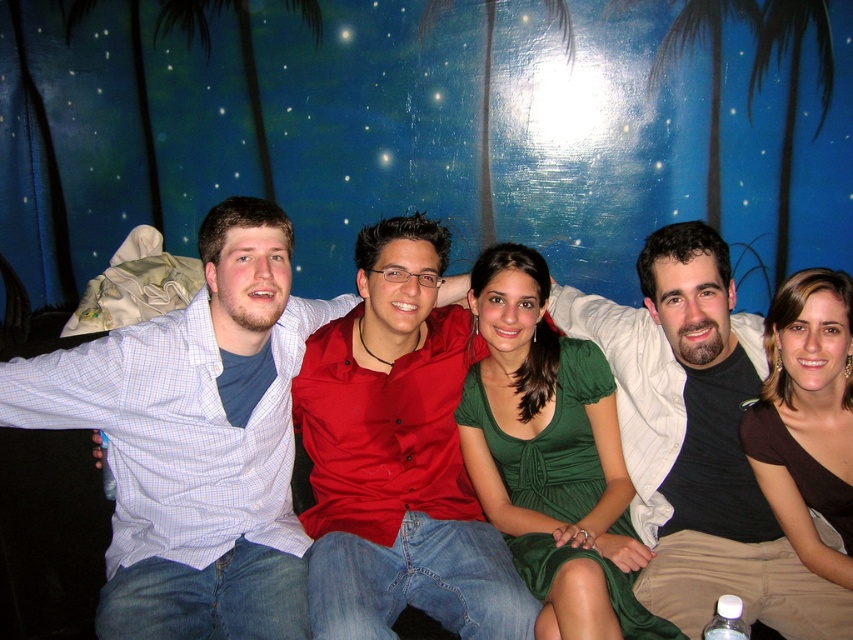
Is blue painted wall at upper center wider than light blue checkered shirt at center?

Yes, blue painted wall at upper center is wider than light blue checkered shirt at center.

Can you confirm if blue painted wall at upper center is smaller than light blue checkered shirt at center?

Actually, blue painted wall at upper center might be larger than light blue checkered shirt at center.

Who is more forward, (x=515, y=227) or (x=207, y=467)?

Positioned in front is point (x=207, y=467).

You are a GUI agent. You are given a task and a screenshot of the screen. Output one action in this format:
    pyautogui.click(x=<x>, y=<y>)
    Task: Click on the blue painted wall at upper center
    The image size is (853, 640).
    Given the screenshot: What is the action you would take?
    pyautogui.click(x=370, y=124)

Is blue painted wall at upper center to the left of matte black shirt at center from the viewer's perspective?

Indeed, blue painted wall at upper center is positioned on the left side of matte black shirt at center.

Which is behind, point (125, 67) or point (776, 624)?

The point (125, 67) is more distant.

Which is behind, point (341, 28) or point (798, 596)?

Positioned behind is point (341, 28).

Image resolution: width=853 pixels, height=640 pixels. In order to click on blue painted wall at upper center in this screenshot , I will do `click(370, 124)`.

Between light blue checkered shirt at center and matte black shirt at center, which one has less height?

Standing shorter between the two is matte black shirt at center.

Where is `light blue checkered shirt at center`? light blue checkered shirt at center is located at coordinates (196, 440).

Describe the element at coordinates (196, 440) in the screenshot. I see `light blue checkered shirt at center` at that location.

I want to click on light blue checkered shirt at center, so click(x=196, y=440).